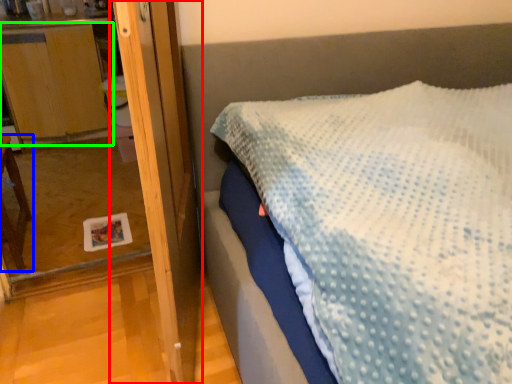
Question: Which object is positioned farthest from screen door (highlighted by a red box)? Select from furniture (highlighted by a blue box) and dresser (highlighted by a green box).

Choices:
 (A) furniture
 (B) dresser

Answer: (B)